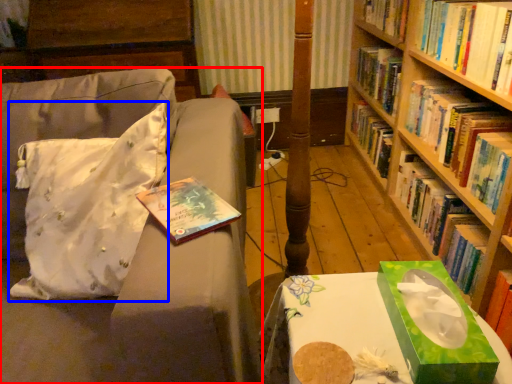
Question: Which object appears closest to the camera in this image, studio couch (highlighted by a red box) or throw pillow (highlighted by a blue box)?

Choices:
 (A) studio couch
 (B) throw pillow

Answer: (A)